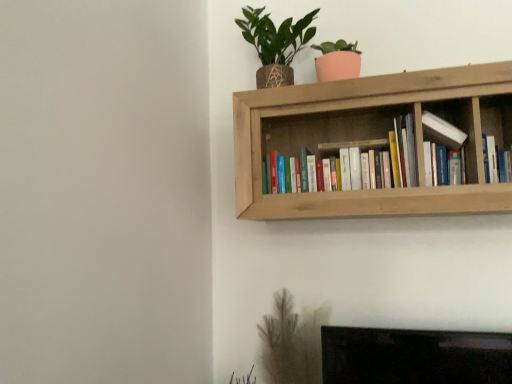
Question: Considering the relative positions of hardcover books at center, the 1th book viewed from the left, and hardcover book at upper right, which is counted as the 1th book, starting from the right, in the image provided, is hardcover books at center, the 1th book viewed from the left, to the left of hardcover book at upper right, which is counted as the 1th book, starting from the right, from the viewer's perspective?

Choices:
 (A) yes
 (B) no

Answer: (A)

Question: Considering the relative positions of hardcover books at center, the 1th book viewed from the left, and hardcover book at upper right, which is counted as the 1th book, starting from the right, in the image provided, is hardcover books at center, the 1th book viewed from the left, to the right of hardcover book at upper right, which is counted as the 1th book, starting from the right, from the viewer's perspective?

Choices:
 (A) yes
 (B) no

Answer: (B)

Question: From a real-world perspective, does hardcover books at center, the 1th book viewed from the left, stand above hardcover book at upper right, positioned as the 2th book in left-to-right order?

Choices:
 (A) no
 (B) yes

Answer: (B)

Question: From the image's perspective, does hardcover books at center, arranged as the second book when viewed from the right, appear higher than hardcover book at upper right, which is counted as the 1th book, starting from the right?

Choices:
 (A) yes
 (B) no

Answer: (A)

Question: From a real-world perspective, is hardcover books at center, arranged as the second book when viewed from the right, under hardcover book at upper right, which is counted as the 1th book, starting from the right?

Choices:
 (A) yes
 (B) no

Answer: (B)

Question: Is point (284, 29) closer or farther from the camera than point (236, 185)?

Choices:
 (A) farther
 (B) closer

Answer: (A)

Question: Is green leafy plant in woven pot at upper right in front of or behind natural wood bookshelf at upper center in the image?

Choices:
 (A) behind
 (B) front

Answer: (A)

Question: From a real-world perspective, is green leafy plant in woven pot at upper right positioned above or below natural wood bookshelf at upper center?

Choices:
 (A) above
 (B) below

Answer: (A)

Question: Is green leafy plant in woven pot at upper right bigger or smaller than natural wood bookshelf at upper center?

Choices:
 (A) small
 (B) big

Answer: (A)

Question: In terms of width, does white glossy bookshelf at upper right look wider or thinner when compared to hardcover book at upper right, which is counted as the 1th book, starting from the right?

Choices:
 (A) thin
 (B) wide

Answer: (A)

Question: Based on their positions, is white glossy bookshelf at upper right located to the left or right of hardcover book at upper right, positioned as the 2th book in left-to-right order?

Choices:
 (A) left
 (B) right

Answer: (A)

Question: Considering their positions, is white glossy bookshelf at upper right located in front of or behind hardcover book at upper right, positioned as the 2th book in left-to-right order?

Choices:
 (A) behind
 (B) front

Answer: (B)

Question: Would you say white glossy bookshelf at upper right is inside or outside hardcover book at upper right, which is counted as the 1th book, starting from the right?

Choices:
 (A) inside
 (B) outside

Answer: (B)

Question: Considering the relative positions of hardcover books at center, arranged as the second book when viewed from the right, and natural wood bookshelf at upper center in the image provided, is hardcover books at center, arranged as the second book when viewed from the right, to the left or to the right of natural wood bookshelf at upper center?

Choices:
 (A) right
 (B) left

Answer: (B)

Question: Is point (297, 130) closer or farther from the camera than point (460, 66)?

Choices:
 (A) farther
 (B) closer

Answer: (A)